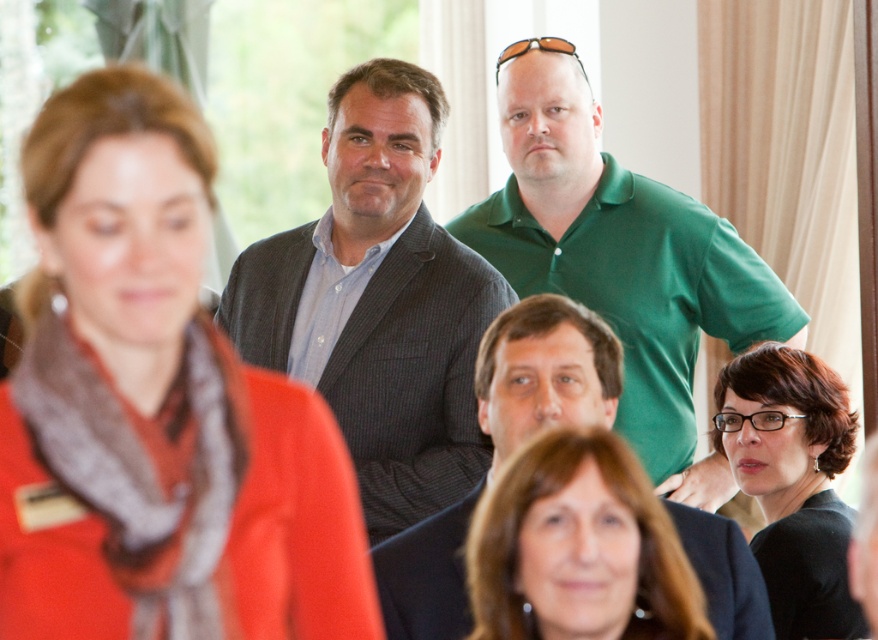
Question: Which object appears closest to the camera in this image?

Choices:
 (A) green smooth shirt at upper center
 (B) matte brown hair at center

Answer: (B)

Question: Does matte red scarf at center have a greater width compared to matte brown hair at center?

Choices:
 (A) yes
 (B) no

Answer: (A)

Question: Does matte red scarf at center have a larger size compared to matte brown hair at center?

Choices:
 (A) no
 (B) yes

Answer: (B)

Question: Is matte gray blazer at center wider than green smooth shirt at upper center?

Choices:
 (A) yes
 (B) no

Answer: (B)

Question: Which object is closer to the camera taking this photo?

Choices:
 (A) matte brown hair at center
 (B) black glossy glasses at center

Answer: (A)

Question: Which object is positioned closest to the green smooth shirt at upper center?

Choices:
 (A) matte gray blazer at center
 (B) matte red scarf at center

Answer: (A)